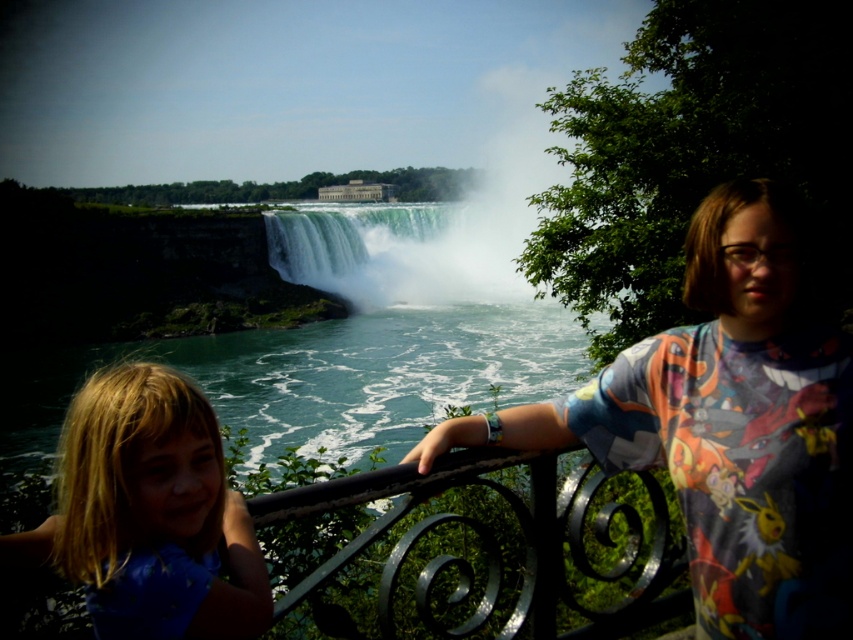
Is black wrought iron at center positioned in front of green translucent water at center?

Yes, it is in front of green translucent water at center.

Does black wrought iron at center appear over green translucent water at center?

Actually, black wrought iron at center is below green translucent water at center.

Between point (654, 605) and point (456, 280), which one is positioned in front?

Point (654, 605) is more forward.

The image size is (853, 640). In order to click on black wrought iron at center in this screenshot , I will do `click(519, 524)`.

Who is positioned more to the right, blue fabric shirt at lower left or black wrought iron at center?

black wrought iron at center is more to the right.

Does blue fabric shirt at lower left have a smaller size compared to black wrought iron at center?

Incorrect, blue fabric shirt at lower left is not smaller in size than black wrought iron at center.

The width and height of the screenshot is (853, 640). I want to click on blue fabric shirt at lower left, so click(x=149, y=513).

Image resolution: width=853 pixels, height=640 pixels. In order to click on blue fabric shirt at lower left in this screenshot , I will do `click(149, 513)`.

Does multicolored fabric shirt at right appear on the left side of blue fabric shirt at lower left?

No, multicolored fabric shirt at right is not to the left of blue fabric shirt at lower left.

Who is more distant from viewer, [786,500] or [97,568]?

The point [786,500] is behind.

What do you see at coordinates (727, 422) in the screenshot? I see `multicolored fabric shirt at right` at bounding box center [727, 422].

Locate an element on the screen. The height and width of the screenshot is (640, 853). multicolored fabric shirt at right is located at coordinates (727, 422).